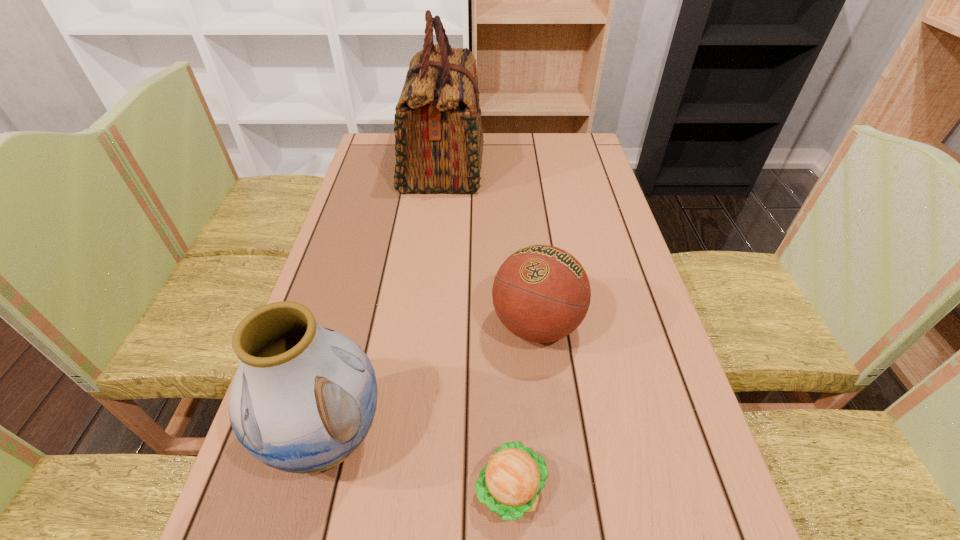
Identify the location of shopping bag. (438, 129).

You are a GUI agent. You are given a task and a screenshot of the screen. Output one action in this format:
    pyautogui.click(x=<x>, y=<y>)
    Task: Click on the farthest object
    
    Given the screenshot: What is the action you would take?
    pyautogui.click(x=438, y=129)

Image resolution: width=960 pixels, height=540 pixels. I want to click on vase, so click(x=303, y=399).

You are a GUI agent. You are given a task and a screenshot of the screen. Output one action in this format:
    pyautogui.click(x=<x>, y=<y>)
    Task: Click on the second farthest object
    The height and width of the screenshot is (540, 960).
    Given the screenshot: What is the action you would take?
    pyautogui.click(x=541, y=293)

This screenshot has height=540, width=960. I want to click on the third tallest object, so click(541, 293).

Locate an element on the screen. Image resolution: width=960 pixels, height=540 pixels. the shortest object is located at coordinates (510, 483).

Where is `vacant area situated on the open handle side of the shopping bag`? vacant area situated on the open handle side of the shopping bag is located at coordinates (596, 164).

This screenshot has width=960, height=540. What are the coordinates of `free location located on the right of the vase` in the screenshot? It's located at (557, 436).

Find the location of `free spot located 0.390m on the back of the basketball`. free spot located 0.390m on the back of the basketball is located at coordinates point(522,198).

At what (x,y) coordinates should I click in order to perform the action: click on free space located on the left of the shortest object. Please return your answer as a coordinate pair (x, y). The height and width of the screenshot is (540, 960). Looking at the image, I should click on (315, 489).